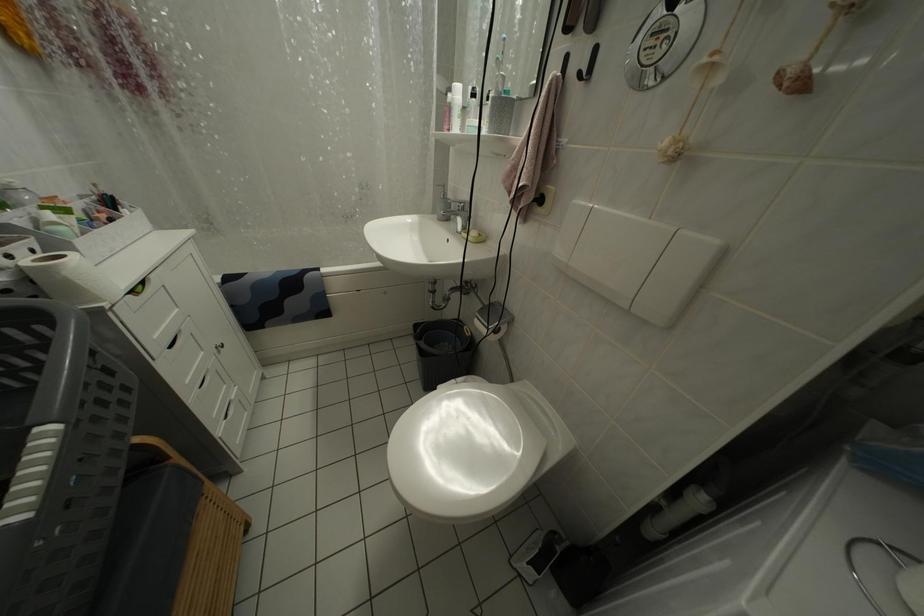
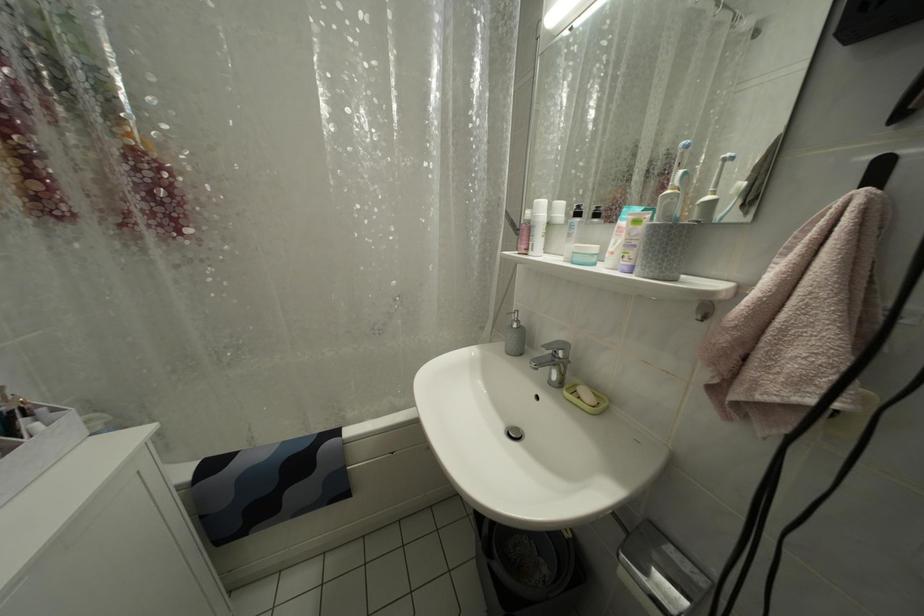
In a continuous first-person perspective shot, in which direction is the camera moving?

The cameraman moved toward left, forward.